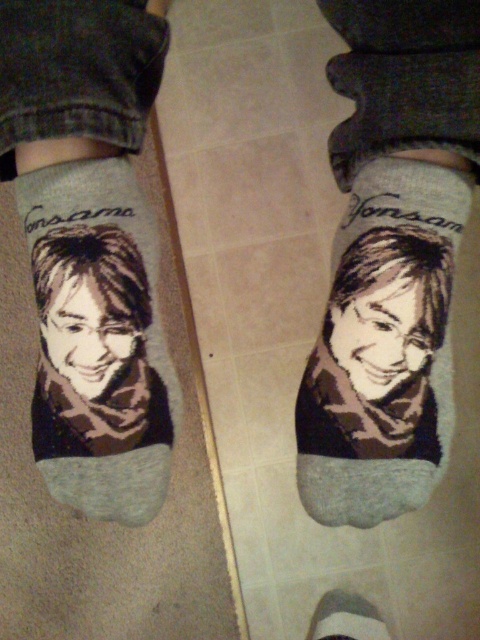
Question: Is matte gray socks at center bigger than printed fabric socks at center?

Choices:
 (A) no
 (B) yes

Answer: (B)

Question: Which of the following is the closest to the observer?

Choices:
 (A) matte gray socks at center
 (B) printed fabric socks at center

Answer: (A)

Question: Which point is farther to the camera?

Choices:
 (A) (87, 227)
 (B) (363, 221)

Answer: (B)

Question: Is matte gray socks at center smaller than printed fabric socks at center?

Choices:
 (A) yes
 (B) no

Answer: (B)

Question: Does matte gray socks at center appear over printed fabric socks at center?

Choices:
 (A) no
 (B) yes

Answer: (A)